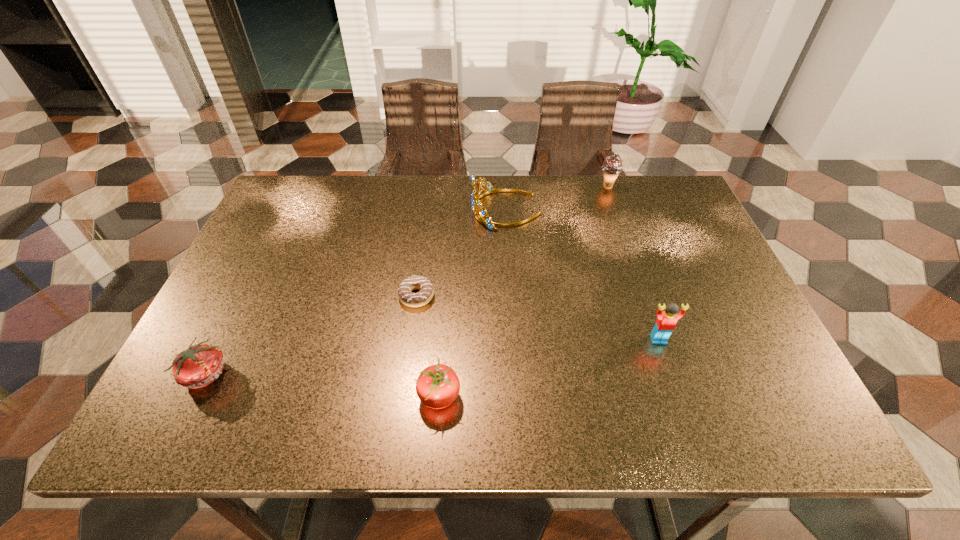
Where is `vacant area at the near edge of the desktop`? vacant area at the near edge of the desktop is located at coordinates (367, 400).

This screenshot has width=960, height=540. In the image, there is a desktop. Identify the location of vacant space at the left edge. (231, 304).

In the image, there is a desktop. In order to click on free space at the right edge in this screenshot , I will do `click(687, 294)`.

The height and width of the screenshot is (540, 960). In order to click on free space at the far left corner of the desktop in this screenshot , I will do `click(306, 220)`.

This screenshot has height=540, width=960. Find the location of `free space at the near right corner`. free space at the near right corner is located at coordinates (753, 420).

This screenshot has height=540, width=960. What are the coordinates of `free space between the doughnut and the icecream` in the screenshot? It's located at (512, 241).

Image resolution: width=960 pixels, height=540 pixels. In order to click on vacant space that's between the tiara and the icecream in this screenshot , I will do `click(557, 198)`.

Identify the location of free space between the Lego and the right tomato. This screenshot has height=540, width=960. pos(549,368).

You are a GUI agent. You are given a task and a screenshot of the screen. Output one action in this format:
    pyautogui.click(x=<x>, y=<y>)
    Task: Click on the free space between the icecream and the Lego
    The width and height of the screenshot is (960, 540).
    Given the screenshot: What is the action you would take?
    pyautogui.click(x=633, y=263)

I want to click on empty location between the leftmost object and the shortest object, so click(311, 335).